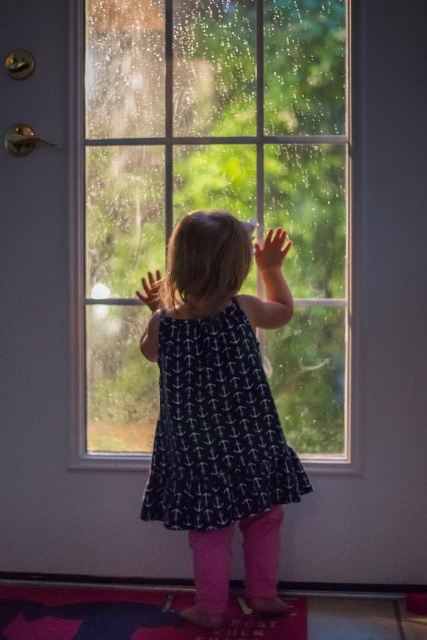
You are a parent trying to ensure your child stays safe while they explore the clear glass window at center and smooth skin hand at upper center. Which object is positioned to the right of the other?

The clear glass window at center is to the right of smooth skin hand at upper center, so the window is positioned to the right of the hand.

You are a drone operator trying to deliver a small package to the child in the image. The delivery point is at point (342, 428). However, there is an obstacle at point (151, 276). Can you safely navigate the drone to the delivery point without hitting the obstacle?

Point (342, 428) is further to the viewer than point (151, 276), so the drone can safely navigate to the delivery point as the obstacle is behind it.

You are a parent trying to ensure your child is safe. The child is touching the clear glass window at center and the transparent glass hand at upper center. Which object is closer to the child?

The transparent glass hand at upper center is closer to the child because it is positioned below the clear glass window at center, meaning the hand is in front of the window.